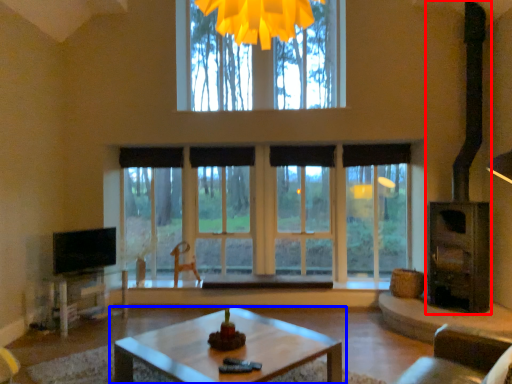
Question: Among these objects, which one is nearest to the camera, fireplace (highlighted by a red box) or coffee table (highlighted by a blue box)?

Choices:
 (A) fireplace
 (B) coffee table

Answer: (B)